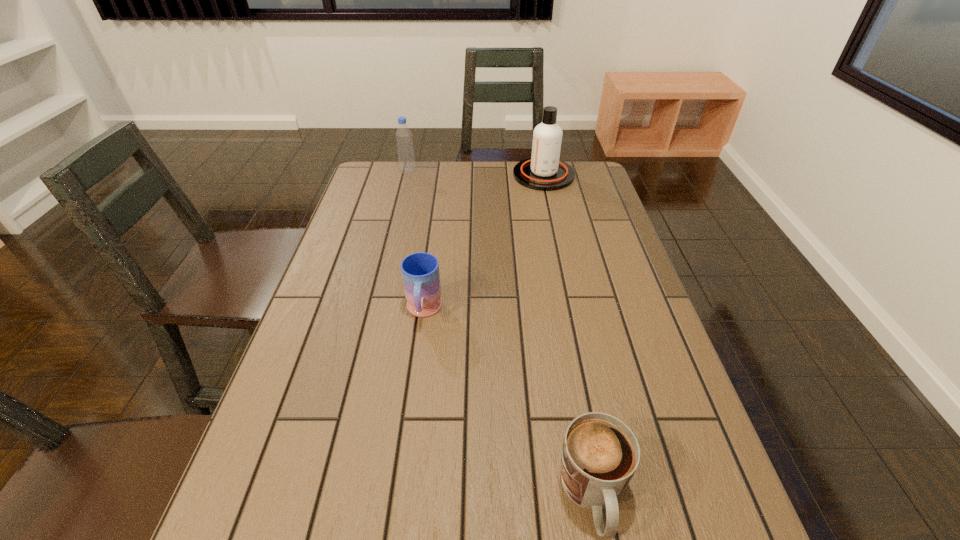
You are a GUI agent. You are given a task and a screenshot of the screen. Output one action in this format:
    pyautogui.click(x=<x>, y=<y>)
    Task: Click on the object that ranks as the closest to the second tallest object
    This screenshot has width=960, height=540.
    Given the screenshot: What is the action you would take?
    pyautogui.click(x=544, y=171)

This screenshot has width=960, height=540. I want to click on object identified as the third closest to the left mug, so (404, 140).